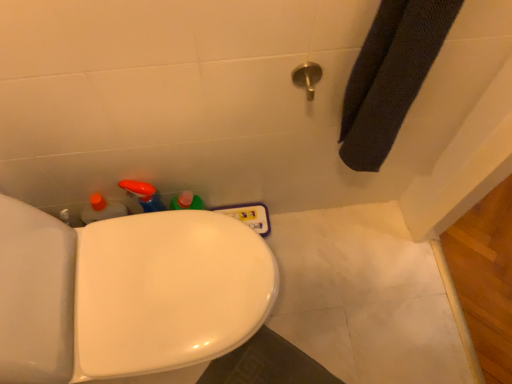
Question: Should I look upward or downward to see metallic silver showerhead at upper center?

Choices:
 (A) down
 (B) up

Answer: (B)

Question: Does metallic silver showerhead at upper center come behind white glossy toilet at lower left?

Choices:
 (A) no
 (B) yes

Answer: (B)

Question: Would you say white glossy toilet at lower left is part of metallic silver showerhead at upper center's contents?

Choices:
 (A) yes
 (B) no

Answer: (B)

Question: Are metallic silver showerhead at upper center and white glossy toilet at lower left located far from each other?

Choices:
 (A) yes
 (B) no

Answer: (B)

Question: From the image's perspective, is metallic silver showerhead at upper center located beneath white glossy toilet at lower left?

Choices:
 (A) no
 (B) yes

Answer: (A)

Question: Is metallic silver showerhead at upper center at the left side of white glossy toilet at lower left?

Choices:
 (A) no
 (B) yes

Answer: (A)

Question: Is metallic silver showerhead at upper center completely or partially outside of white glossy toilet at lower left?

Choices:
 (A) no
 (B) yes

Answer: (B)

Question: Does white glossy toilet at lower left have a greater width compared to metallic silver showerhead at upper center?

Choices:
 (A) no
 (B) yes

Answer: (B)

Question: Are white glossy toilet at lower left and metallic silver showerhead at upper center far apart?

Choices:
 (A) no
 (B) yes

Answer: (A)

Question: Does white glossy toilet at lower left have a smaller size compared to metallic silver showerhead at upper center?

Choices:
 (A) no
 (B) yes

Answer: (A)

Question: Does white glossy toilet at lower left have a larger size compared to metallic silver showerhead at upper center?

Choices:
 (A) no
 (B) yes

Answer: (B)

Question: Can you confirm if white glossy toilet at lower left is thinner than metallic silver showerhead at upper center?

Choices:
 (A) yes
 (B) no

Answer: (B)

Question: Is the depth of white glossy toilet at lower left less than that of metallic silver showerhead at upper center?

Choices:
 (A) no
 (B) yes

Answer: (B)

Question: Is white glossy toilet at lower left situated inside metallic silver showerhead at upper center or outside?

Choices:
 (A) inside
 (B) outside

Answer: (B)